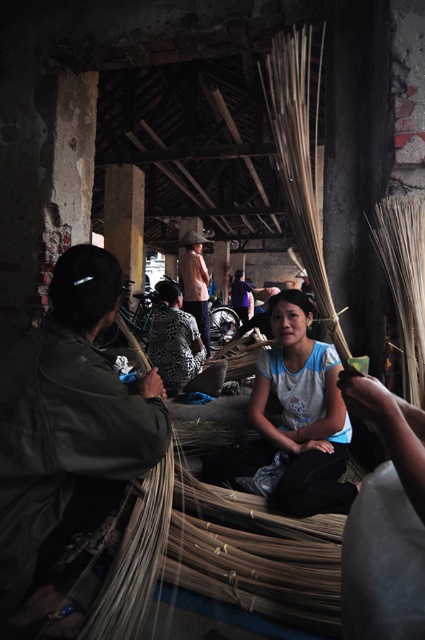
You are standing in the workshop and need to reach both the printed fabric shirt at center and the light brown woven hat at upper center. If you can only move forward in a straight line, which item will you encounter first?

The printed fabric shirt at center is closer to you than the light brown woven hat at upper center, so you will encounter the printed fabric shirt at center first.

You are a customer in this workshop and want to buy both the printed fabric shirt at center and the light brown woven hat at upper center. From your perspective standing in front of the items, which item is positioned to the right?

The light brown woven hat at upper center is to the right of the printed fabric shirt at center, so the light brown woven hat at upper center is positioned to the right.

You are standing in the workshop and need to locate both the dark green leather jacket at left and the light brown woven hat at upper center. Based on their positions, which object is closer to the entrance of the workshop?

The dark green leather jacket at left is to the right of the light brown woven hat at upper center, so the light brown woven hat at upper center is closer to the entrance since it is positioned to the left of the jacket.